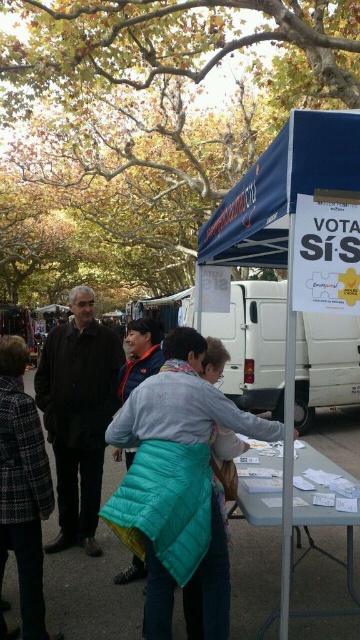
Is teal quilted jacket at center smaller than white matte van at center?

Correct, teal quilted jacket at center occupies less space than white matte van at center.

Who is positioned more to the right, teal quilted jacket at center or white matte van at center?

From the viewer's perspective, white matte van at center appears more on the right side.

The image size is (360, 640). Identify the location of teal quilted jacket at center. (180, 483).

Find the location of `teal quilted jacket at center`. teal quilted jacket at center is located at coordinates (180, 483).

Is teal quilted jacket at center below plaid wool coat at center?

No, teal quilted jacket at center is not below plaid wool coat at center.

Which is behind, point (153, 406) or point (39, 593)?

The point (39, 593) is behind.

Identify the location of teal quilted jacket at center. (180, 483).

Is teal quilted jacket at center to the right of dark brown leather jacket at left from the viewer's perspective?

Yes, teal quilted jacket at center is to the right of dark brown leather jacket at left.

Is teal quilted jacket at center shorter than dark brown leather jacket at left?

Indeed, teal quilted jacket at center has a lesser height compared to dark brown leather jacket at left.

Between point (209, 605) and point (61, 328), which one is positioned behind?

Positioned behind is point (61, 328).

You are a GUI agent. You are given a task and a screenshot of the screen. Output one action in this format:
    pyautogui.click(x=<x>, y=<y>)
    Task: Click on the teal quilted jacket at center
    The image size is (360, 640).
    Given the screenshot: What is the action you would take?
    pyautogui.click(x=180, y=483)